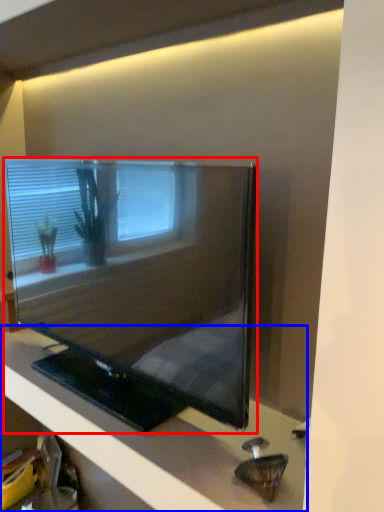
Question: Which object appears closest to the camera in this image, television (highlighted by a red box) or furniture (highlighted by a blue box)?

Choices:
 (A) television
 (B) furniture

Answer: (B)